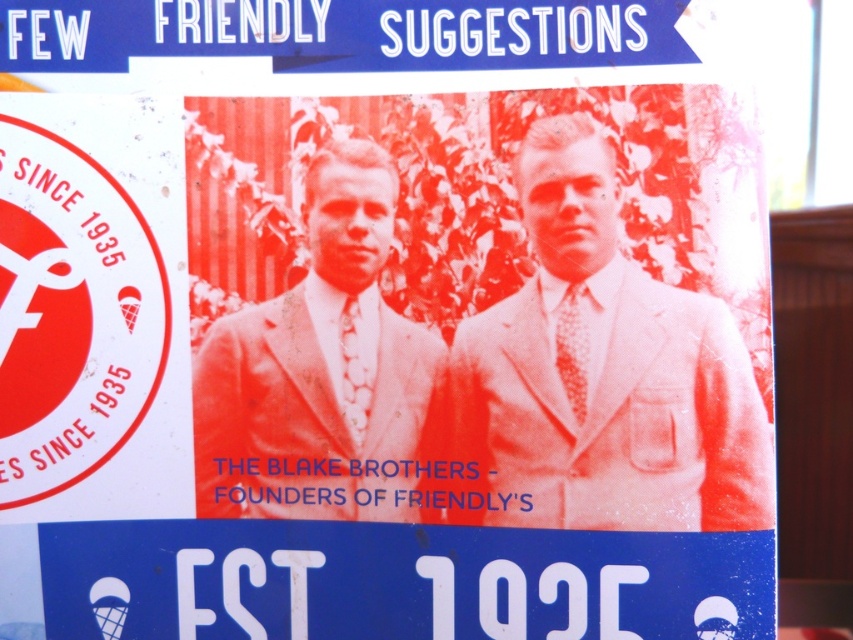
You are an assistant analyzing the poster. Where is the white textured suit at center positioned relative to the other elements in the scene?

The white textured suit at center is located at point 0.577 on the x axis and 0.709 on the y axis.